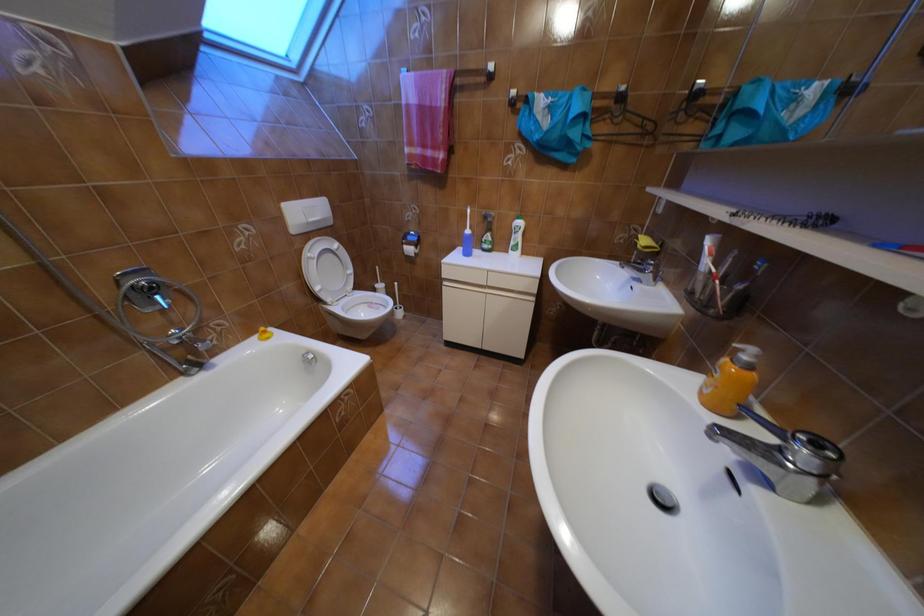
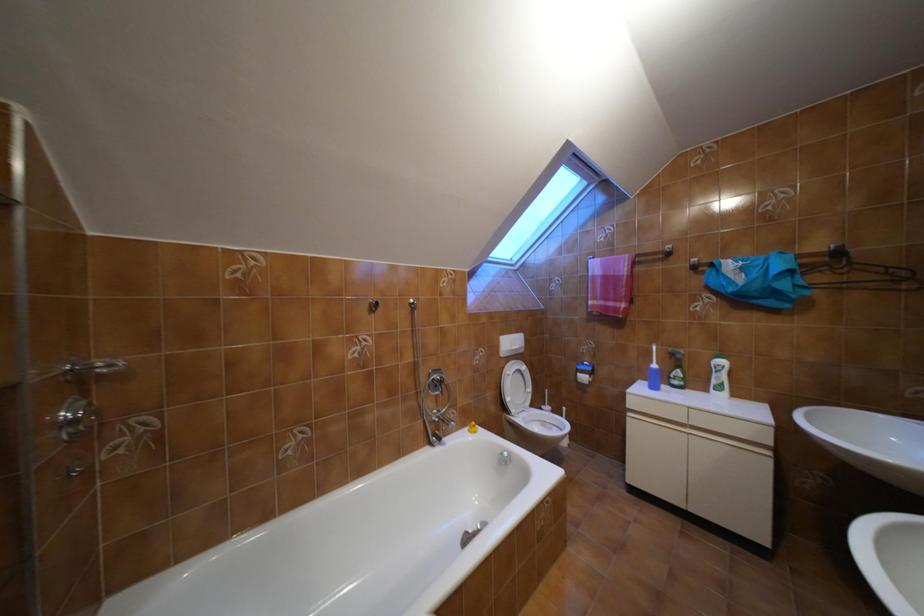
The first image is from the beginning of the video and the second image is from the end. How did the camera likely rotate when shooting the video?

The rotation direction of the camera is left-up.